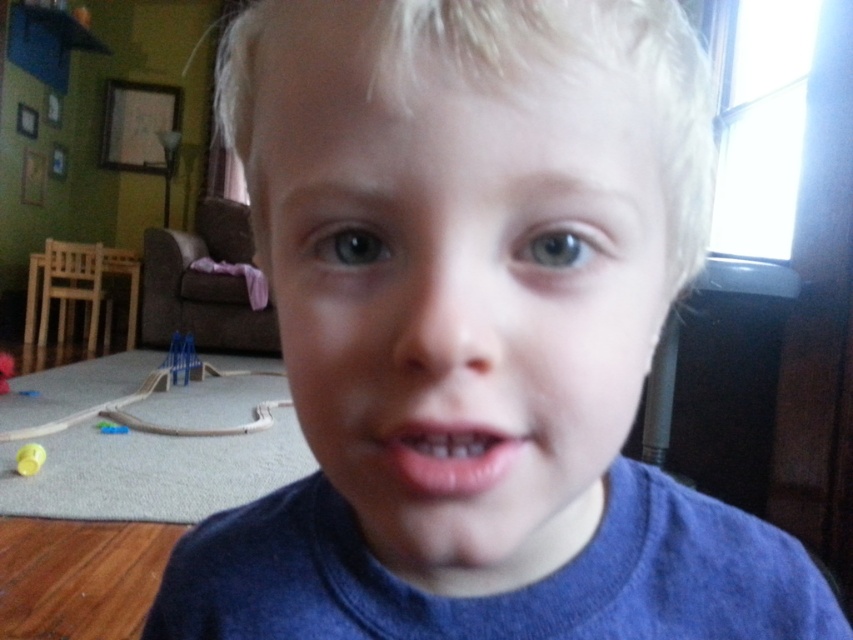
You are a photographer trying to capture the child in the image. You want to ensure both the smooth skin face at center and the yellow rubber ball at lower left are clearly visible in your photo. Given their size difference, which object should you focus on first to ensure proper focus?

The smooth skin face at center has a larger size compared to the yellow rubber ball at lower left, so you should focus on the smooth skin face at center first to ensure it is in focus, as it is the larger subject and likely the main focus of the image.

Looking at the child in the blue shirt, can you tell if the smooth skin face at center is larger than the pink glossy lips at center?

The smooth skin face at center is bigger than the pink glossy lips at center, so yes, the face is larger than the lips.

Looking at the scene, where is the smooth skin face at center in relation to the yellow rubber ball at lower left?

The smooth skin face at center is to the right of the yellow rubber ball at lower left.